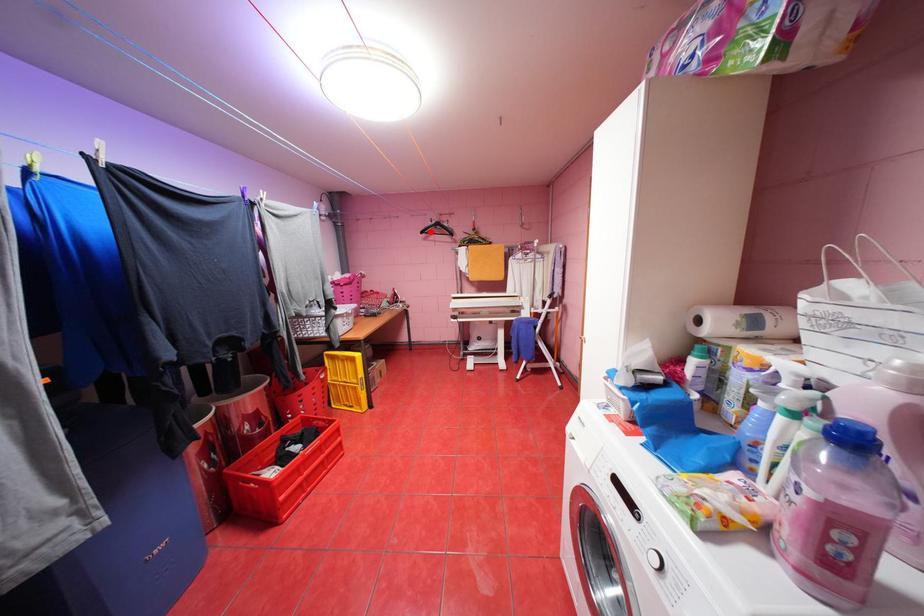
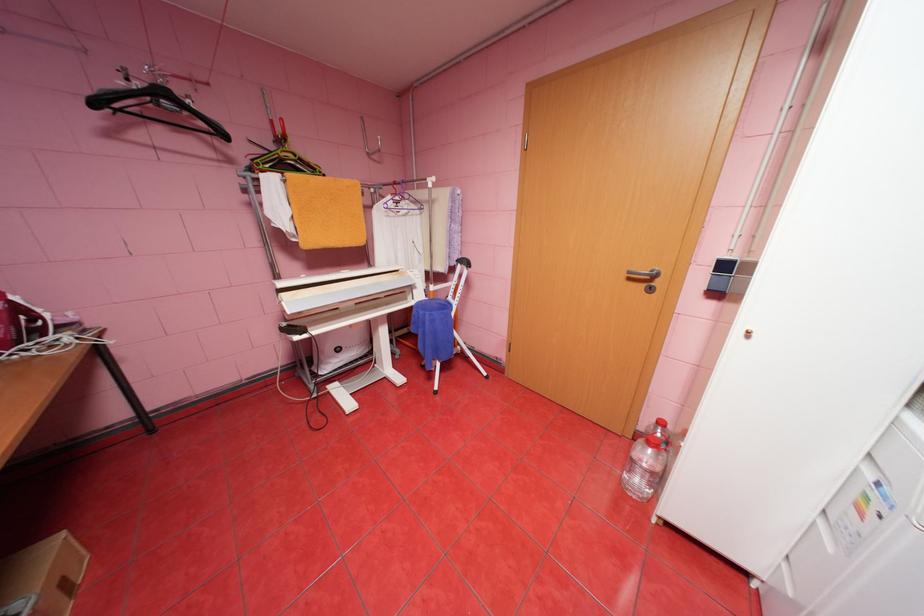
In the second image, find the point that corresponds to the highlighted location in the first image.

(103, 103)